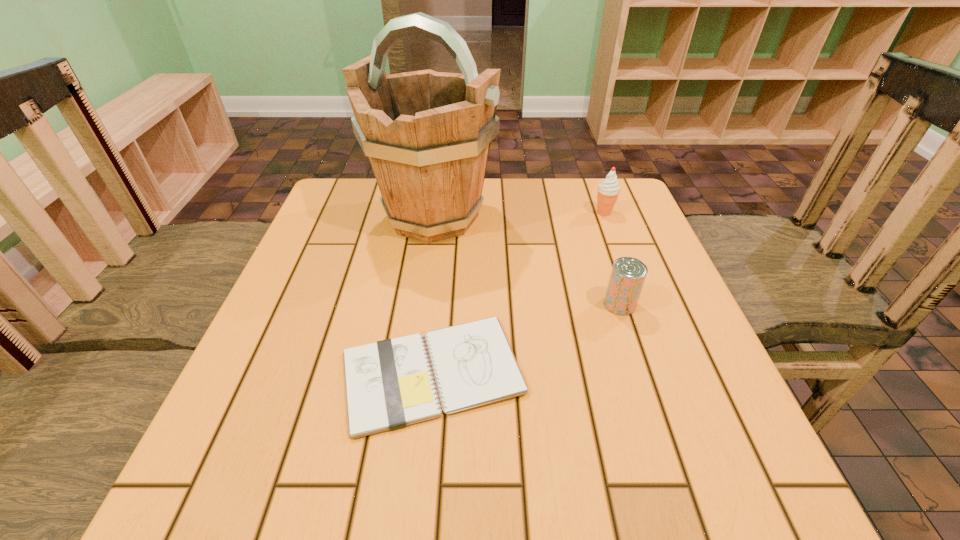
The image size is (960, 540). In order to click on bucket in this screenshot , I will do pos(427,134).

Where is `icecream`? The height and width of the screenshot is (540, 960). icecream is located at coordinates (608, 191).

The height and width of the screenshot is (540, 960). In order to click on beer can in this screenshot , I will do `click(628, 274)`.

This screenshot has height=540, width=960. In order to click on the third farthest object in this screenshot , I will do `click(628, 274)`.

You are a GUI agent. You are given a task and a screenshot of the screen. Output one action in this format:
    pyautogui.click(x=<x>, y=<y>)
    Task: Click on the shortest object
    
    Given the screenshot: What is the action you would take?
    pyautogui.click(x=389, y=384)

Locate an element on the screen. the nearest object is located at coordinates click(389, 384).

Locate an element on the screen. Image resolution: width=960 pixels, height=540 pixels. vacant space situated 0.250m on the right of the bucket is located at coordinates (595, 216).

Identify the location of vacant space situated 0.100m on the back of the second tallest object. (594, 187).

You are a GUI agent. You are given a task and a screenshot of the screen. Output one action in this format:
    pyautogui.click(x=<x>, y=<y>)
    Task: Click on the free space located on the back of the beer can
    The height and width of the screenshot is (540, 960).
    Given the screenshot: What is the action you would take?
    pyautogui.click(x=600, y=246)

Find the location of `free space located on the right of the nearest object`. free space located on the right of the nearest object is located at coordinates (578, 373).